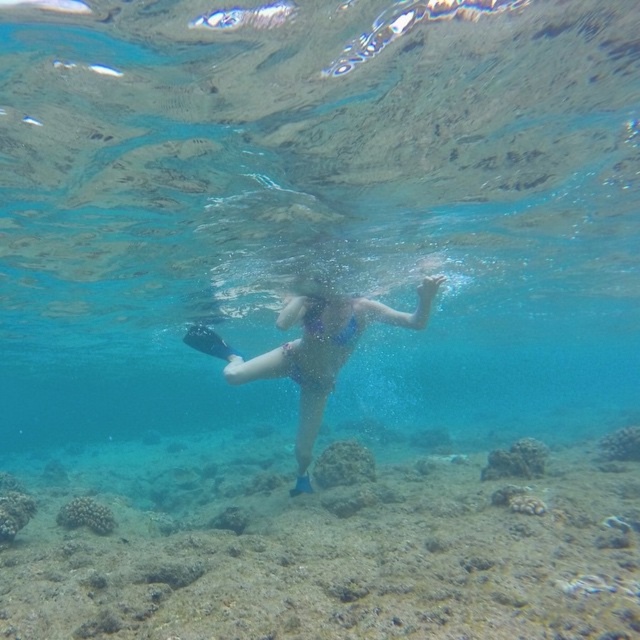
Does clear blue water at center have a greater width compared to blue matte swimsuit at center?

Correct, the width of clear blue water at center exceeds that of blue matte swimsuit at center.

Can you confirm if clear blue water at center is positioned above blue matte swimsuit at center?

Actually, clear blue water at center is below blue matte swimsuit at center.

This screenshot has width=640, height=640. I want to click on clear blue water at center, so click(x=314, y=205).

Does clear blue water at center have a smaller size compared to rough textured coral reef at center?

Actually, clear blue water at center might be larger than rough textured coral reef at center.

Is clear blue water at center above rough textured coral reef at center?

No, clear blue water at center is not above rough textured coral reef at center.

Does point (484, 138) come behind point (216, 564)?

Yes.

Locate an element on the screen. The width and height of the screenshot is (640, 640). clear blue water at center is located at coordinates (314, 205).

Is rough textured coral reef at center to the left of blue matte swimsuit at center from the viewer's perspective?

In fact, rough textured coral reef at center is to the right of blue matte swimsuit at center.

Can you confirm if rough textured coral reef at center is positioned to the right of blue matte swimsuit at center?

Correct, you'll find rough textured coral reef at center to the right of blue matte swimsuit at center.

Find the location of `rough textured coral reef at center`. rough textured coral reef at center is located at coordinates (330, 547).